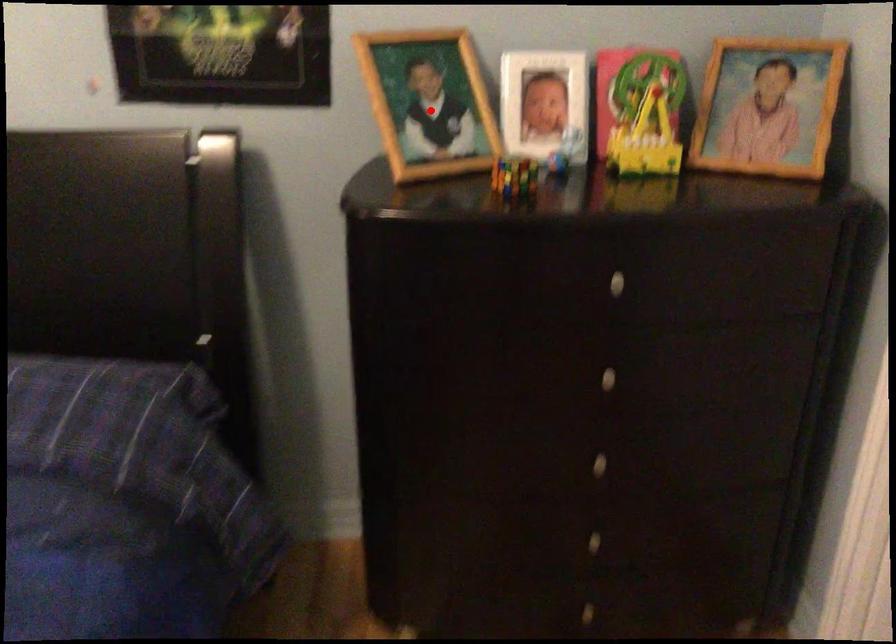
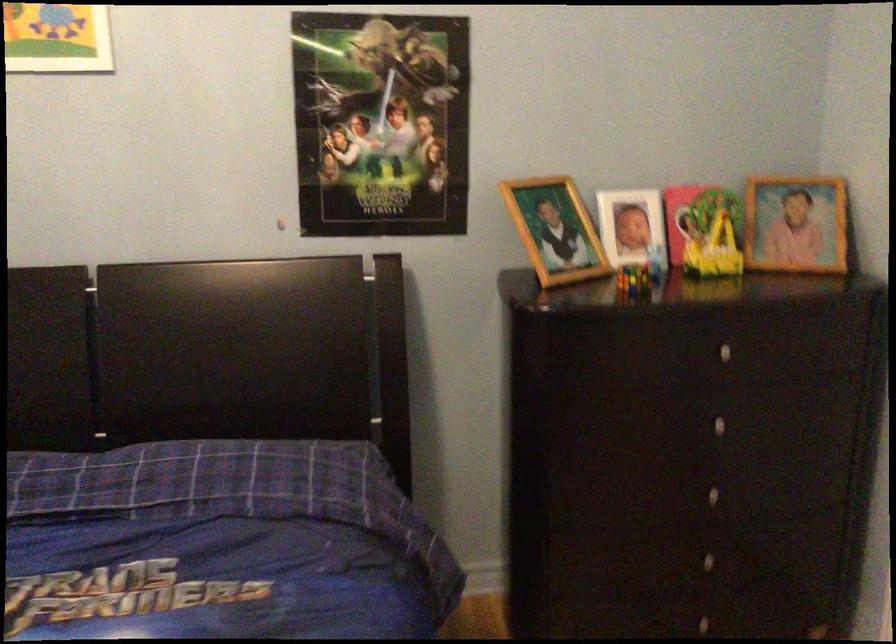
Question: I am providing you with two images of the same scene from different viewpoints. Image1 has a red point marked. In image2, the corresponding 3D location appears at what relative position? Reply with the corresponding letter.

Choices:
 (A) Closer
 (B) Farther

Answer: (B)